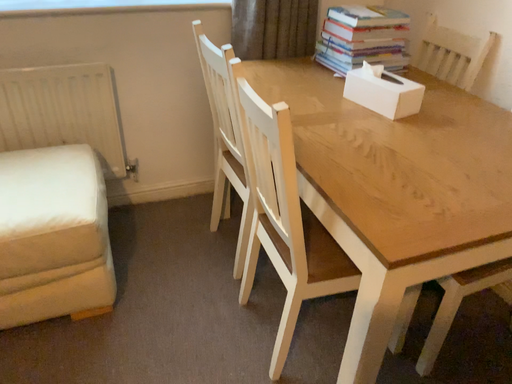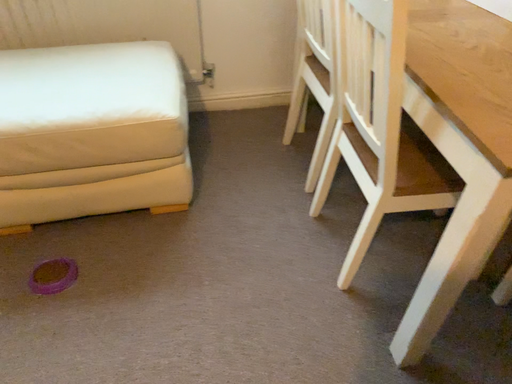
Question: Which way did the camera rotate in the video?

Choices:
 (A) rotated upward
 (B) rotated downward

Answer: (B)